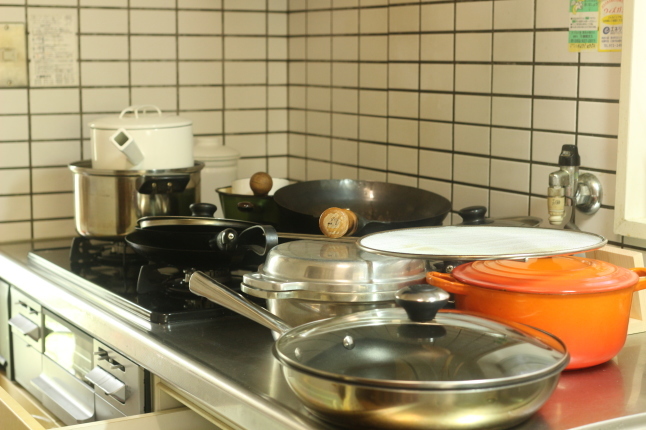
The height and width of the screenshot is (430, 646). I want to click on white pots and pans, so click(x=162, y=135), click(x=242, y=184), click(x=482, y=244).